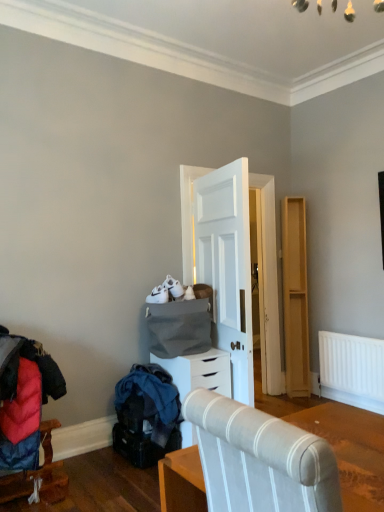
Question: Is light wood dresser at right next to velvet red coat at lower left, the second furniture viewed from the front?

Choices:
 (A) yes
 (B) no

Answer: (B)

Question: Is light wood dresser at right far from velvet red coat at lower left, the first furniture in the back-to-front sequence?

Choices:
 (A) yes
 (B) no

Answer: (A)

Question: From the image's perspective, is light wood dresser at right beneath velvet red coat at lower left, which is counted as the second furniture, starting from the top?

Choices:
 (A) no
 (B) yes

Answer: (A)

Question: From a real-world perspective, is light wood dresser at right below velvet red coat at lower left, the first furniture positioned from the left?

Choices:
 (A) no
 (B) yes

Answer: (A)

Question: Considering the relative positions of light wood dresser at right and velvet red coat at lower left, the first furniture positioned from the left, in the image provided, is light wood dresser at right to the left of velvet red coat at lower left, the first furniture positioned from the left, from the viewer's perspective?

Choices:
 (A) no
 (B) yes

Answer: (A)

Question: Considering the positions of white matte chest of drawers at center and light wood dresser at right in the image, is white matte chest of drawers at center wider or thinner than light wood dresser at right?

Choices:
 (A) wide
 (B) thin

Answer: (A)

Question: From the image's perspective, relative to light wood dresser at right, is white matte chest of drawers at center above or below?

Choices:
 (A) below
 (B) above

Answer: (A)

Question: Considering the positions of point (226, 393) and point (294, 291), is point (226, 393) closer or farther from the camera than point (294, 291)?

Choices:
 (A) farther
 (B) closer

Answer: (B)

Question: From a real-world perspective, is white matte chest of drawers at center physically located above or below light wood dresser at right?

Choices:
 (A) above
 (B) below

Answer: (B)

Question: Is point (56, 484) positioned closer to the camera than point (223, 354)?

Choices:
 (A) farther
 (B) closer

Answer: (B)

Question: Is velvet red coat at lower left, acting as the 1th furniture starting from the bottom, wider or thinner than white matte chest of drawers at center?

Choices:
 (A) wide
 (B) thin

Answer: (B)

Question: In the image, is velvet red coat at lower left, acting as the 1th furniture starting from the bottom, on the left side or the right side of white matte chest of drawers at center?

Choices:
 (A) right
 (B) left

Answer: (B)

Question: From a real-world perspective, relative to white matte chest of drawers at center, is velvet red coat at lower left, the first furniture positioned from the left, vertically above or below?

Choices:
 (A) below
 (B) above

Answer: (A)

Question: Is point (299, 380) closer or farther from the camera than point (193, 365)?

Choices:
 (A) closer
 (B) farther

Answer: (B)

Question: In the image, is light wood dresser at right positioned in front of or behind white matte chest of drawers at center?

Choices:
 (A) front
 (B) behind

Answer: (B)